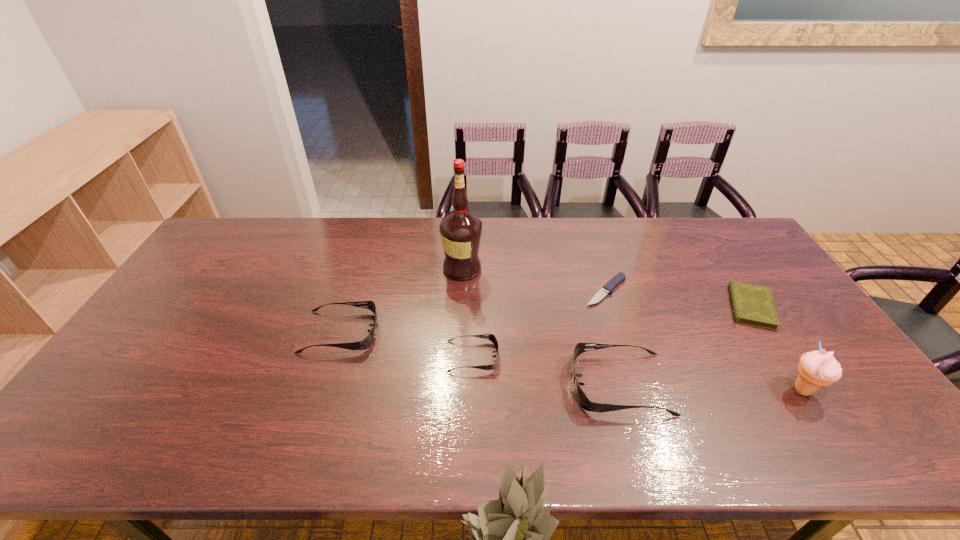
Find the location of a particular element. The height and width of the screenshot is (540, 960). icecream that is at the near edge is located at coordinates (819, 368).

Where is `diary that is at the right edge`? The image size is (960, 540). diary that is at the right edge is located at coordinates (754, 305).

Find the location of a particular element. The width and height of the screenshot is (960, 540). icecream at the right edge is located at coordinates pos(819,368).

Locate an element on the screen. object present at the near right corner is located at coordinates (819, 368).

In order to click on vacant position at the far edge of the desktop in this screenshot , I will do `click(365, 222)`.

This screenshot has height=540, width=960. Identify the location of vacant space at the left edge of the desktop. (175, 330).

Identify the location of free location at the right edge. (769, 333).

At what (x,y) coordinates should I click in order to perform the action: click on vacant position at the far left corner of the desktop. Please return your answer as a coordinate pair (x, y). The width and height of the screenshot is (960, 540). Looking at the image, I should click on (252, 218).

In the image, there is a desktop. At what (x,y) coordinates should I click in order to perform the action: click on vacant space at the near left corner. Please return your answer as a coordinate pair (x, y). This screenshot has height=540, width=960. Looking at the image, I should click on (110, 390).

Locate an element on the screen. blank space at the far right corner of the desktop is located at coordinates (739, 255).